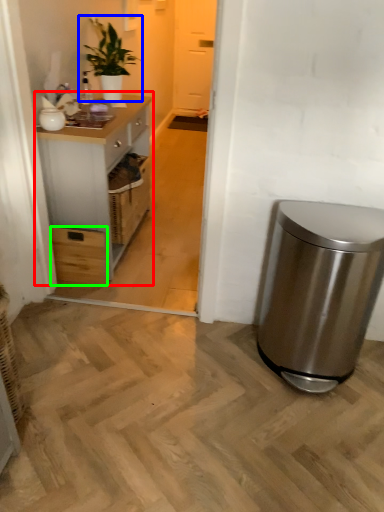
Question: Which object is positioned farthest from cabinetry (highlighted by a red box)? Select from houseplant (highlighted by a blue box) and drawer (highlighted by a green box).

Choices:
 (A) houseplant
 (B) drawer

Answer: (A)